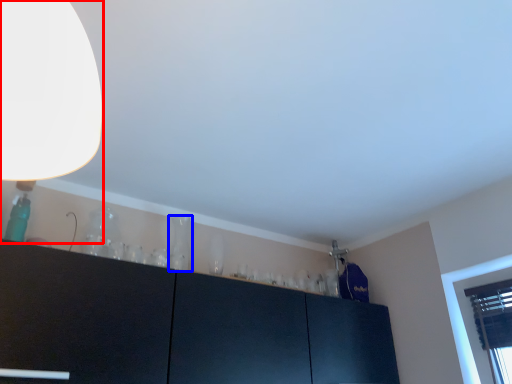
Question: Which of the following is the farthest to the observer, lamp (highlighted by a red box) or glass vase (highlighted by a blue box)?

Choices:
 (A) lamp
 (B) glass vase

Answer: (B)